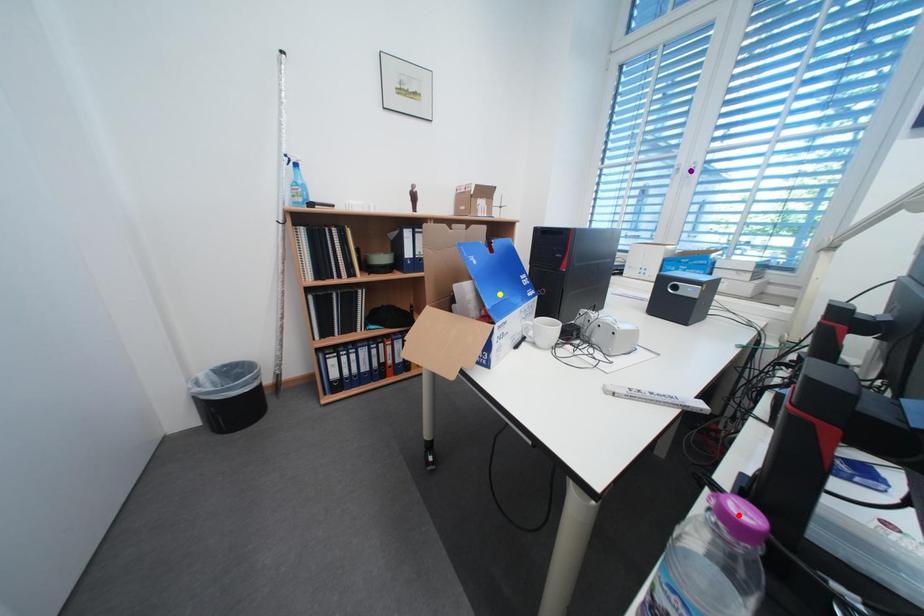
Order these from nearest to farthest:
purple point
yellow point
red point

red point
yellow point
purple point